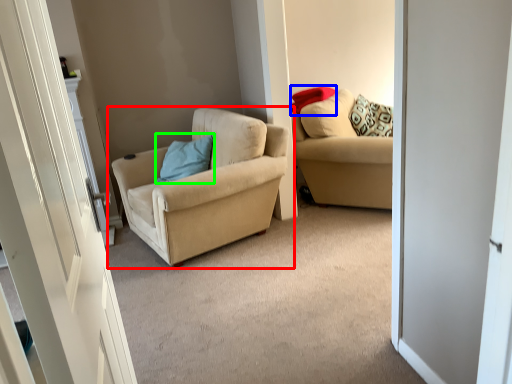
Question: Which is nearer to the chair (highlighted by a red box)? pillow (highlighted by a blue box) or pillow (highlighted by a green box).

Choices:
 (A) pillow
 (B) pillow

Answer: (B)